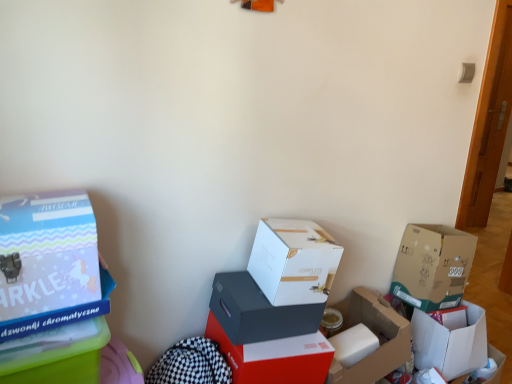
Describe the element at coordinates (450, 342) in the screenshot. Image resolution: width=512 pixels, height=384 pixels. I see `white cardboard box at lower right, the 1th box in the right-to-left sequence` at that location.

Image resolution: width=512 pixels, height=384 pixels. What do you see at coordinates (48, 252) in the screenshot?
I see `pastel blue cardboard box at left, which ranks as the 7th box in right-to-left order` at bounding box center [48, 252].

What is the approximate height of cardboard box at lower right, the 3th box viewed from the right?

11.35 inches.

What do you see at coordinates (293, 261) in the screenshot?
I see `white matte box at center, arranged as the 5th box when viewed from the left` at bounding box center [293, 261].

Find the location of a particular element. The image size is (512, 384). white matte box at center, arranged as the 5th box when viewed from the left is located at coordinates (293, 261).

Describe the element at coordinates (432, 266) in the screenshot. I see `cardboard box at right, which ranks as the 2th box in right-to-left order` at that location.

Where is `matte black box at center, placed as the fourth box when sorted from left to right`? Image resolution: width=512 pixels, height=384 pixels. matte black box at center, placed as the fourth box when sorted from left to right is located at coordinates (258, 311).

Is cardboard box at right, which ranks as the 2th box in right-to-left order, shorter than matte red box at center, which appears as the sixth box when viewed from the right?

Incorrect, the height of cardboard box at right, which ranks as the 2th box in right-to-left order, does not fall short of that of matte red box at center, which appears as the sixth box when viewed from the right.

Can you confirm if cardboard box at right, which ranks as the 2th box in right-to-left order, is wider than matte red box at center, which appears as the sixth box when viewed from the right?

No, cardboard box at right, which ranks as the 2th box in right-to-left order, is not wider than matte red box at center, which appears as the sixth box when viewed from the right.

Is cardboard box at right, the 7th box when ordered from left to right, bigger than matte red box at center, which appears as the sixth box when viewed from the right?

No.

Could matte red box at center, which appears as the sixth box when viewed from the right, be considered to be inside cardboard box at right, which ranks as the 2th box in right-to-left order?

No, matte red box at center, which appears as the sixth box when viewed from the right, is not inside cardboard box at right, which ranks as the 2th box in right-to-left order.

Is white matte box at center, arranged as the 5th box when viewed from the left, located outside white cardboard box at lower right, which is counted as the eighth box, starting from the left?

Indeed, white matte box at center, arranged as the 5th box when viewed from the left, is completely outside white cardboard box at lower right, which is counted as the eighth box, starting from the left.

From a real-world perspective, is white matte box at center, the fourth box from the right, over white cardboard box at lower right, which is counted as the eighth box, starting from the left?

Yes.

Considering the relative sizes of white matte box at center, arranged as the 5th box when viewed from the left, and white cardboard box at lower right, the 1th box in the right-to-left sequence, in the image provided, is white matte box at center, arranged as the 5th box when viewed from the left, bigger than white cardboard box at lower right, the 1th box in the right-to-left sequence,?

Indeed, white matte box at center, arranged as the 5th box when viewed from the left, has a larger size compared to white cardboard box at lower right, the 1th box in the right-to-left sequence.

From the image's perspective, is white matte box at center, the fourth box from the right, under white cardboard box at lower right, the 1th box in the right-to-left sequence?

No, from the image's perspective, white matte box at center, the fourth box from the right, is not beneath white cardboard box at lower right, the 1th box in the right-to-left sequence.

Can we say matte blue box at left, which appears as the 1th box when viewed from the left, lies outside pastel blue cardboard box at left, which ranks as the 7th box in right-to-left order?

Yes.

Between matte blue box at left, which appears as the 1th box when viewed from the left, and pastel blue cardboard box at left, the second box in the left-to-right sequence, which one is positioned behind?

Positioned behind is matte blue box at left, which appears as the 1th box when viewed from the left.

From the image's perspective, which one is positioned lower, matte blue box at left, which appears as the 1th box when viewed from the left, or pastel blue cardboard box at left, the second box in the left-to-right sequence?

matte blue box at left, which appears as the 1th box when viewed from the left, is shown below in the image.

In terms of height, does matte blue box at left, which appears as the 1th box when viewed from the left, look taller or shorter compared to pastel blue cardboard box at left, the second box in the left-to-right sequence?

Clearly, matte blue box at left, which appears as the 1th box when viewed from the left, is shorter compared to pastel blue cardboard box at left, the second box in the left-to-right sequence.

From the image's perspective, which object appears higher, matte blue box at left, placed as the eighth box when sorted from right to left, or cardboard box at lower right, the 6th box in the left-to-right sequence?

matte blue box at left, placed as the eighth box when sorted from right to left.

Which of these two, matte blue box at left, placed as the eighth box when sorted from right to left, or cardboard box at lower right, the 6th box in the left-to-right sequence, is thinner?

With smaller width is matte blue box at left, placed as the eighth box when sorted from right to left.

Is matte black box at center, which is the 5th box in right-to-left order, oriented towards white cardboard box at lower right, which is counted as the eighth box, starting from the left?

No, matte black box at center, which is the 5th box in right-to-left order, is not facing towards white cardboard box at lower right, which is counted as the eighth box, starting from the left.

Does point (240, 287) come farther from viewer compared to point (430, 326)?

No, it is not.

Which of these two, matte black box at center, which is the 5th box in right-to-left order, or white cardboard box at lower right, which is counted as the eighth box, starting from the left, is bigger?

With larger size is matte black box at center, which is the 5th box in right-to-left order.

Find the location of a particular element. This screenshot has height=384, width=512. the 5th box counting from the right of the pastel blue cardboard box at left, which ranks as the 7th box in right-to-left order is located at coordinates (432, 266).

In the scene shown: Is the depth of cardboard box at right, the 7th box when ordered from left to right, less than that of pastel blue cardboard box at left, which ranks as the 7th box in right-to-left order?

No, it is not.

Is cardboard box at right, the 7th box when ordered from left to right, oriented towards matte black box at center, which is the 5th box in right-to-left order?

No, cardboard box at right, the 7th box when ordered from left to right, is not turned towards matte black box at center, which is the 5th box in right-to-left order.

Does cardboard box at right, the 7th box when ordered from left to right, lie behind matte black box at center, which is the 5th box in right-to-left order?

Yes, cardboard box at right, the 7th box when ordered from left to right, is further from the camera.

Looking at their sizes, would you say cardboard box at right, which ranks as the 2th box in right-to-left order, is wider or thinner than matte black box at center, which is the 5th box in right-to-left order?

Considering their sizes, cardboard box at right, which ranks as the 2th box in right-to-left order, looks broader than matte black box at center, which is the 5th box in right-to-left order.

Would you consider cardboard box at right, the 7th box when ordered from left to right, to be distant from matte black box at center, placed as the fourth box when sorted from left to right?

Actually, cardboard box at right, the 7th box when ordered from left to right, and matte black box at center, placed as the fourth box when sorted from left to right, are a little close together.

I want to click on the 4th box to the right of the matte red box at center, which appears as the sixth box when viewed from the right, starting your count from the anchor, so click(x=432, y=266).

From a real-world perspective, which box is the 6th one underneath the white matte box at center, the fourth box from the right? Please provide its 2D coordinates.

[(450, 342)]

When comparing their distances from white matte box at center, arranged as the 5th box when viewed from the left, does matte blue box at left, placed as the eighth box when sorted from right to left, or pastel blue cardboard box at left, the second box in the left-to-right sequence, seem closer?

matte blue box at left, placed as the eighth box when sorted from right to left, lies closer to white matte box at center, arranged as the 5th box when viewed from the left, than the other object.

Which object lies further to the anchor point matte black box at center, placed as the fourth box when sorted from left to right, matte blue box at left, which appears as the 1th box when viewed from the left, or cardboard box at lower right, the 3th box viewed from the right?

matte blue box at left, which appears as the 1th box when viewed from the left, is positioned further to the anchor matte black box at center, placed as the fourth box when sorted from left to right.

From the image, which object appears to be farther from matte red box at center, which ranks as the third box in left-to-right order, pastel blue cardboard box at left, which ranks as the 7th box in right-to-left order, or cardboard box at lower right, the 6th box in the left-to-right sequence?

Based on the image, pastel blue cardboard box at left, which ranks as the 7th box in right-to-left order, appears to be further to matte red box at center, which ranks as the third box in left-to-right order.

Which object lies further to the anchor point pastel blue cardboard box at left, the second box in the left-to-right sequence, cardboard box at right, the 7th box when ordered from left to right, or cardboard box at lower right, the 3th box viewed from the right?

cardboard box at right, the 7th box when ordered from left to right, is positioned further to the anchor pastel blue cardboard box at left, the second box in the left-to-right sequence.

From the image, which object appears to be farther from matte black box at center, which is the 5th box in right-to-left order, cardboard box at lower right, the 3th box viewed from the right, or cardboard box at right, which ranks as the 2th box in right-to-left order?

Based on the image, cardboard box at right, which ranks as the 2th box in right-to-left order, appears to be further to matte black box at center, which is the 5th box in right-to-left order.

Based on their spatial positions, is white matte box at center, arranged as the 5th box when viewed from the left, or matte blue box at left, placed as the eighth box when sorted from right to left, closer to cardboard box at right, the 7th box when ordered from left to right?

white matte box at center, arranged as the 5th box when viewed from the left.

Which object lies further to the anchor point matte red box at center, which appears as the sixth box when viewed from the right, cardboard box at lower right, the 6th box in the left-to-right sequence, or pastel blue cardboard box at left, which ranks as the 7th box in right-to-left order?

Among the two, pastel blue cardboard box at left, which ranks as the 7th box in right-to-left order, is located further to matte red box at center, which appears as the sixth box when viewed from the right.

Estimate the real-world distances between objects in this image. Which object is further from matte blue box at left, placed as the eighth box when sorted from right to left, matte black box at center, which is the 5th box in right-to-left order, or white cardboard box at lower right, which is counted as the eighth box, starting from the left?

white cardboard box at lower right, which is counted as the eighth box, starting from the left, is positioned further to the anchor matte blue box at left, placed as the eighth box when sorted from right to left.

Image resolution: width=512 pixels, height=384 pixels. I want to click on box between cardboard box at lower right, the 3th box viewed from the right, and white cardboard box at lower right, which is counted as the eighth box, starting from the left, so click(x=432, y=266).

Identify the location of box between pastel blue cardboard box at left, which ranks as the 7th box in right-to-left order, and matte black box at center, placed as the fourth box when sorted from left to right, from left to right. (275, 357).

At what (x,y) coordinates should I click in order to perform the action: click on box between matte blue box at left, which appears as the 1th box when viewed from the left, and matte red box at center, which appears as the sixth box when viewed from the right, in the horizontal direction. Please return your answer as a coordinate pair (x, y). Looking at the image, I should click on (48, 252).

Where is `box located between white matte box at center, the fourth box from the right, and cardboard box at right, which ranks as the 2th box in right-to-left order, in the left-right direction`? box located between white matte box at center, the fourth box from the right, and cardboard box at right, which ranks as the 2th box in right-to-left order, in the left-right direction is located at coordinates (375, 332).